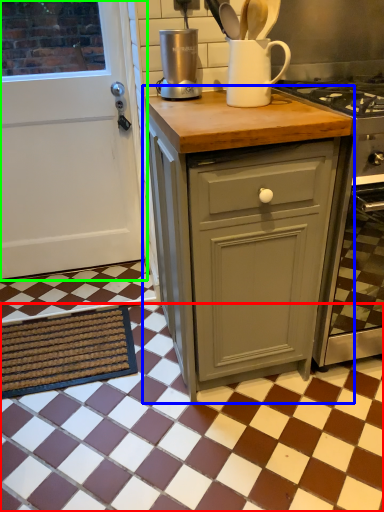
Question: Considering the real-world distances, which object is closest to tile (highlighted by a red box)? cabinetry (highlighted by a blue box) or door (highlighted by a green box).

Choices:
 (A) cabinetry
 (B) door

Answer: (A)